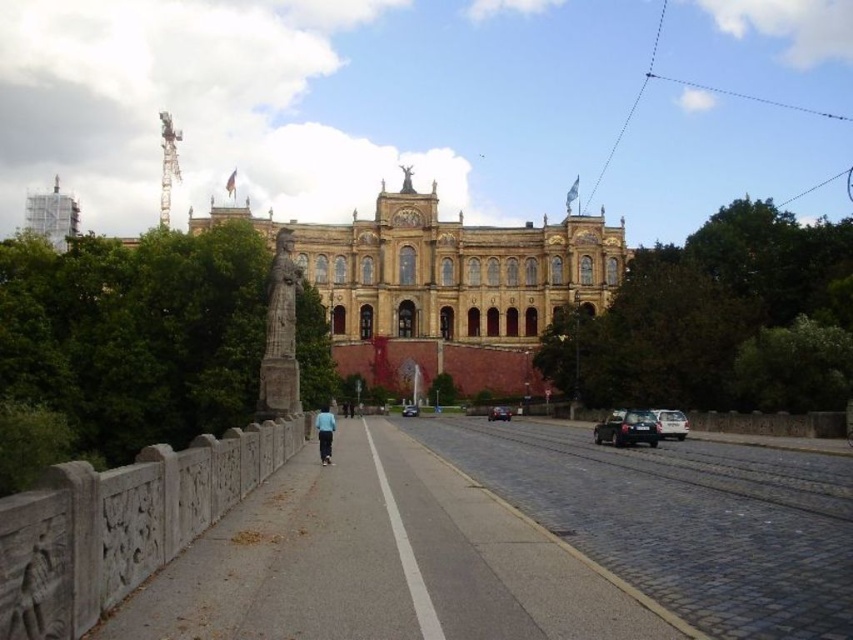
You are a pedestrian standing on the walkway near the brown stone building at center. You want to cross the road to reach the shiny black car at right. Which direction should you walk to get closer to the car?

Since the brown stone building at center is to the left of the shiny black car at right, you should walk to the right along the walkway to get closer to the shiny black car at right.

Consider the image. You are standing on the pedestrian walkway and looking at the grand historic building. There are two points marked on the building facade. Which point, point (415, 257) or point (650, 422), is closer to you?

Point (415, 257) is closer to you because it is further to the viewer than point (650, 422).

You are standing in front of the grand historic building and want to take a photo. You notice two points marked on the ground at coordinates point (640, 420) and point (408, 416). Which point is better to stand on if you want to be closer to the building?

Point (640, 420) is closer to the camera, so standing there would place you closer to the building.